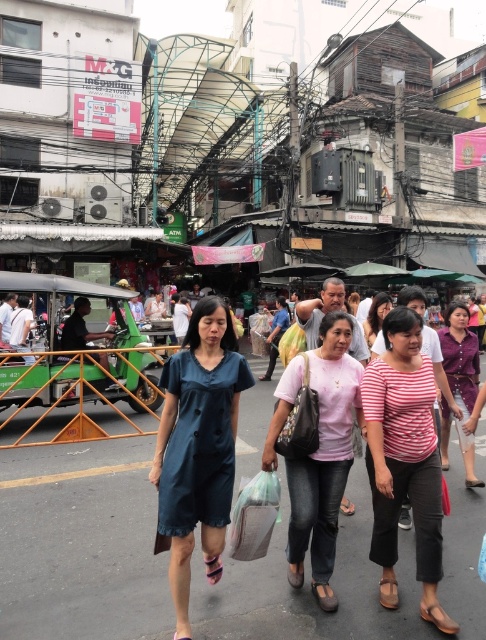
Does striped cotton shirt at center have a lesser width compared to pink matte shirt at center?

Yes, striped cotton shirt at center is thinner than pink matte shirt at center.

Does striped cotton shirt at center have a larger size compared to pink matte shirt at center?

No, striped cotton shirt at center is not bigger than pink matte shirt at center.

This screenshot has height=640, width=486. What do you see at coordinates (404, 460) in the screenshot?
I see `striped cotton shirt at center` at bounding box center [404, 460].

Locate an element on the screen. The height and width of the screenshot is (640, 486). striped cotton shirt at center is located at coordinates (404, 460).

Who is positioned more to the right, purple satin blouse at center or translucent plastic bag at center?

From the viewer's perspective, purple satin blouse at center appears more on the right side.

Does purple satin blouse at center have a lesser height compared to translucent plastic bag at center?

No.

Find the location of a particular element. The height and width of the screenshot is (640, 486). purple satin blouse at center is located at coordinates (460, 356).

What are the coordinates of `purple satin blouse at center` in the screenshot? It's located at (460, 356).

Which is below, striped cotton shirt at center or translucent plastic bag at center?

translucent plastic bag at center is below.

Does striped cotton shirt at center have a greater height compared to translucent plastic bag at center?

Indeed, striped cotton shirt at center has a greater height compared to translucent plastic bag at center.

Between point (419, 499) and point (254, 540), which one is positioned in front?

Point (419, 499) is in front.

At what (x,y) coordinates should I click in order to perform the action: click on striped cotton shirt at center. Please return your answer as a coordinate pair (x, y). This screenshot has height=640, width=486. Looking at the image, I should click on (404, 460).